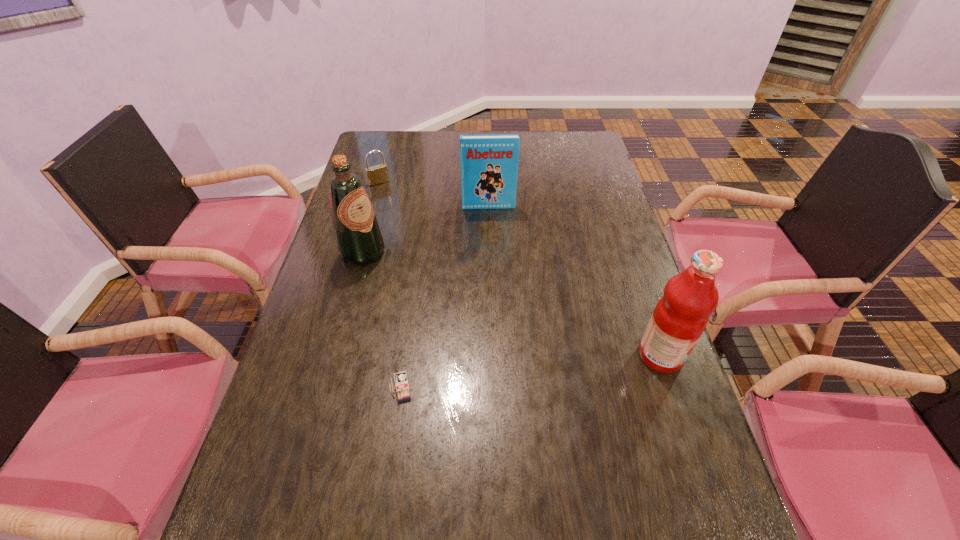
Locate an element on the screen. This screenshot has width=960, height=540. free location located 0.390m on the front-facing side of the third farthest object is located at coordinates (490, 325).

This screenshot has width=960, height=540. I want to click on free spot located 0.260m on the front-facing side of the third farthest object, so click(449, 302).

Find the location of a particular element. This screenshot has width=960, height=540. vacant space located 0.360m on the front-facing side of the third farthest object is located at coordinates (480, 320).

Locate an element on the screen. Image resolution: width=960 pixels, height=540 pixels. free space located 0.300m on the front cover of the second farthest object is located at coordinates (494, 275).

You are a GUI agent. You are given a task and a screenshot of the screen. Output one action in this format:
    pyautogui.click(x=<x>, y=<y>)
    Task: Click on the vacant area situated 0.050m on the front cover of the second farthest object
    This screenshot has width=960, height=540.
    Given the screenshot: What is the action you would take?
    pyautogui.click(x=491, y=219)

The height and width of the screenshot is (540, 960). Identify the location of free location located on the front cover of the second farthest object. (496, 291).

Where is `padlock present at the left edge`? The height and width of the screenshot is (540, 960). padlock present at the left edge is located at coordinates (378, 174).

Where is `olive oil that is at the left edge`? The width and height of the screenshot is (960, 540). olive oil that is at the left edge is located at coordinates (359, 241).

At what (x,y) coordinates should I click in order to perform the action: click on object present at the right edge. Please return your answer as a coordinate pair (x, y). The image size is (960, 540). Looking at the image, I should click on 681,315.

You are a GUI agent. You are given a task and a screenshot of the screen. Output one action in this format:
    pyautogui.click(x=<x>, y=<y>)
    Task: Click on the free space at the far edge of the desktop
    Image resolution: width=960 pixels, height=540 pixels.
    Given the screenshot: What is the action you would take?
    pyautogui.click(x=452, y=156)